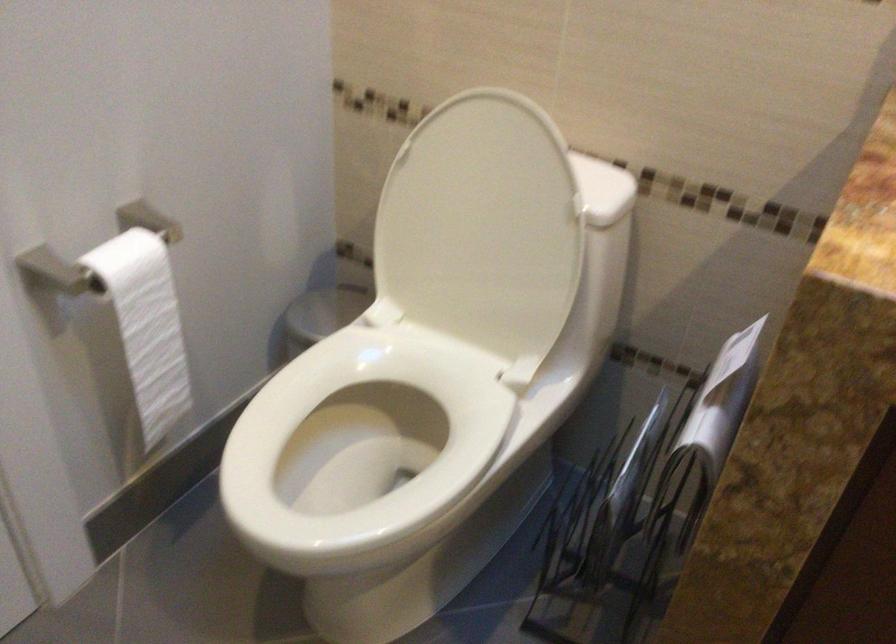
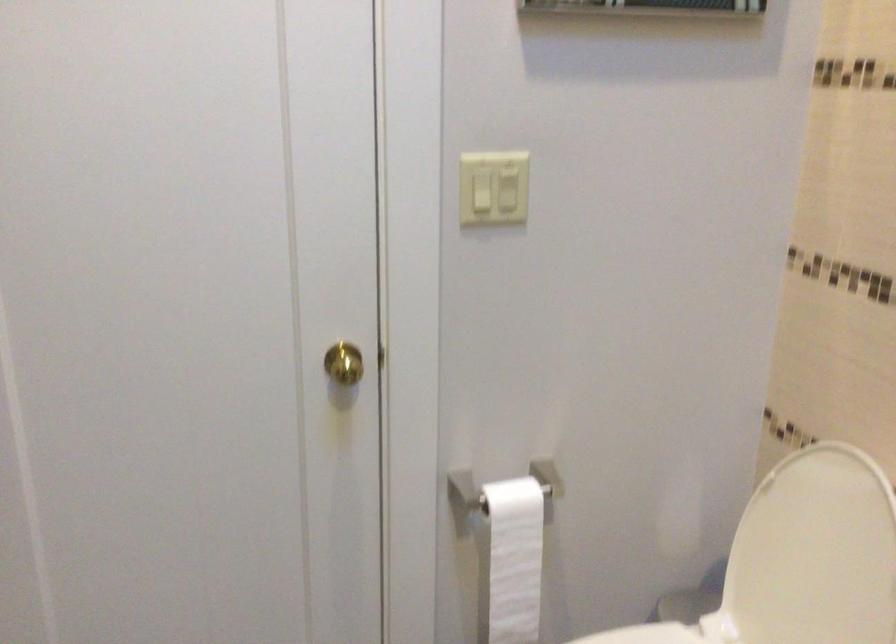
The point at (469, 212) is marked in the first image. Where is the corresponding point in the second image?

(813, 554)